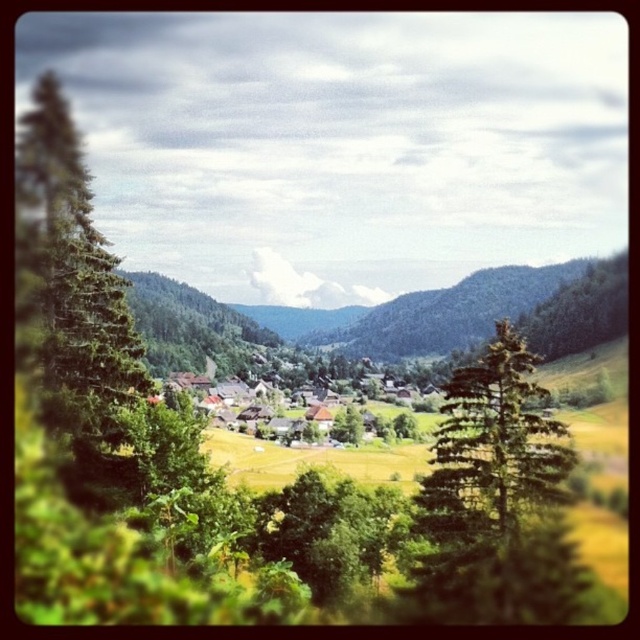
Which of these two, green textured tree at center or wooden houses at center, stands shorter?

Standing shorter between the two is wooden houses at center.

Where is `green textured tree at center`? The image size is (640, 640). green textured tree at center is located at coordinates (488, 460).

Can you confirm if wooden houses at center is positioned to the left of green leafy tree at center?

Correct, you'll find wooden houses at center to the left of green leafy tree at center.

Does point (380, 400) come behind point (348, 422)?

Yes, it is.

Does point (369, 397) lie behind point (336, 440)?

Yes, it is behind point (336, 440).

You are a GUI agent. You are given a task and a screenshot of the screen. Output one action in this format:
    pyautogui.click(x=<x>, y=<y>)
    Task: Click on the wooden houses at center
    This screenshot has width=640, height=640.
    Given the screenshot: What is the action you would take?
    pyautogui.click(x=307, y=394)

Is green textured tree at center wider than green leafy tree at center?

Indeed, green textured tree at center has a greater width compared to green leafy tree at center.

Between green textured tree at center and green leafy tree at center, which one appears on the left side from the viewer's perspective?

From the viewer's perspective, green leafy tree at center appears more on the left side.

Which is in front, point (544, 388) or point (356, 426)?

Point (544, 388) is more forward.

At what (x,y) coordinates should I click in order to perform the action: click on green textured tree at center. Please return your answer as a coordinate pair (x, y). This screenshot has width=640, height=640. Looking at the image, I should click on (488, 460).